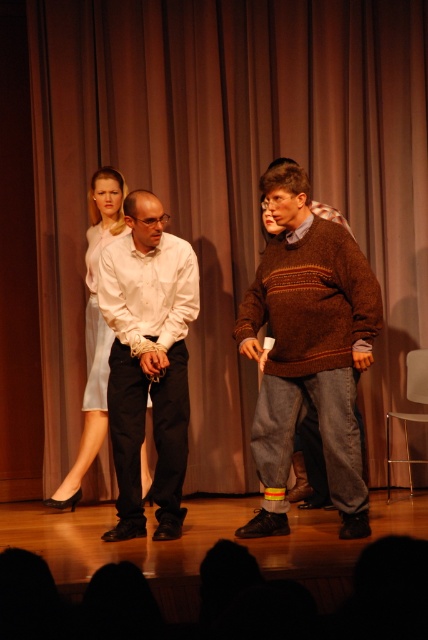
Question: Does brown woolen sweater at center have a larger size compared to light blue satin dress at center?

Choices:
 (A) no
 (B) yes

Answer: (A)

Question: Can you confirm if brown fabric curtain at center is bigger than light blue satin dress at center?

Choices:
 (A) yes
 (B) no

Answer: (A)

Question: Which object is closer to the camera taking this photo?

Choices:
 (A) brown woolen sweater at center
 (B) knitted brown sweater at center
 (C) light blue satin dress at center
 (D) brown fabric curtain at center

Answer: (B)

Question: Is brown fabric curtain at center below light blue satin dress at center?

Choices:
 (A) yes
 (B) no

Answer: (B)

Question: Which of the following is the closest to the observer?

Choices:
 (A) light blue satin dress at center
 (B) knitted brown sweater at center

Answer: (B)

Question: Which of the following is the closest to the observer?

Choices:
 (A) (172, 330)
 (B) (71, 172)

Answer: (A)